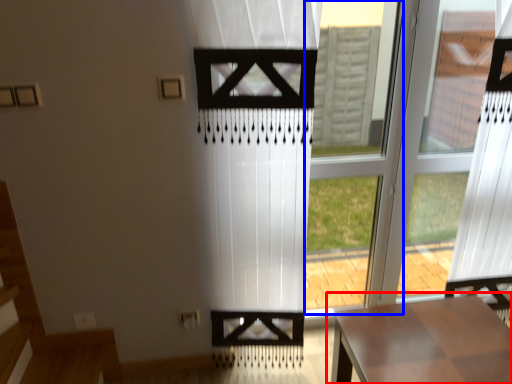
Question: Which object appears farthest to the camera in this image, table (highlighted by a red box) or window frame (highlighted by a blue box)?

Choices:
 (A) table
 (B) window frame

Answer: (B)